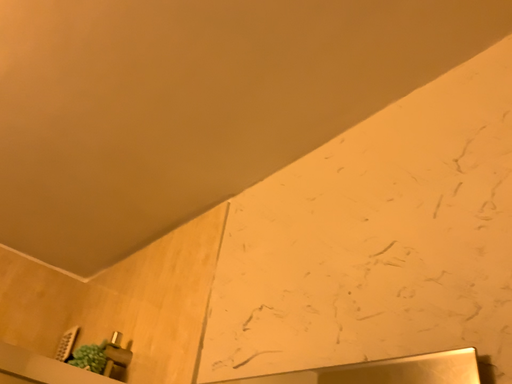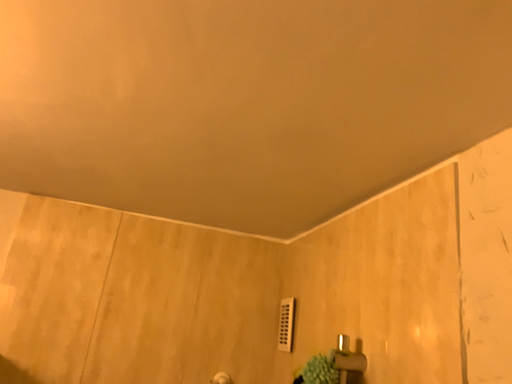
Question: How did the camera likely rotate when shooting the video?

Choices:
 (A) rotated right
 (B) rotated left

Answer: (B)